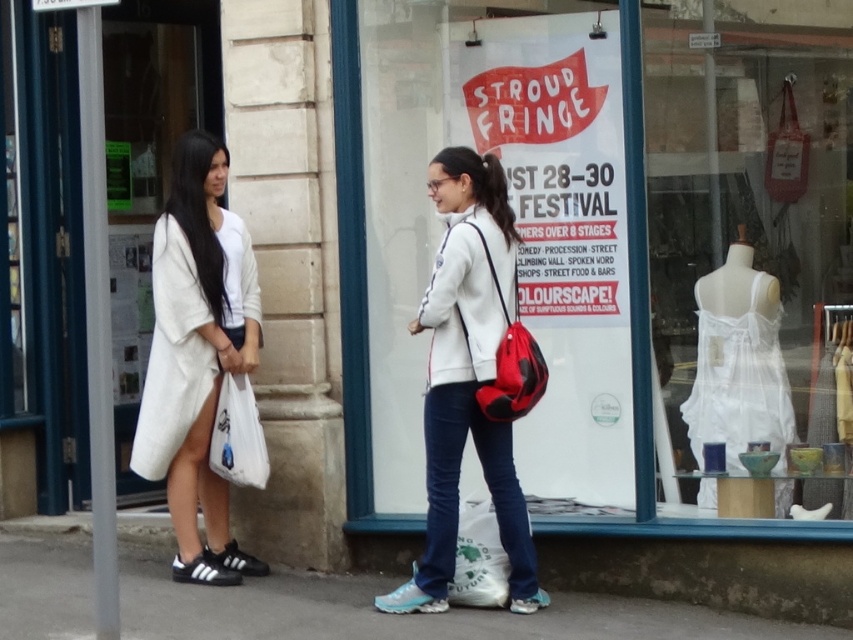
Question: Can you confirm if white sheer fabric dress at right is smaller than white matte jacket at center?

Choices:
 (A) no
 (B) yes

Answer: (A)

Question: Can you confirm if white sheer fabric dress at right is smaller than white cotton coat at left?

Choices:
 (A) no
 (B) yes

Answer: (A)

Question: Which object is positioned farthest from the gray concrete pavement at lower center?

Choices:
 (A) white matte jacket at center
 (B) white cotton coat at left

Answer: (B)

Question: Which of the following is the closest to the observer?

Choices:
 (A) gray concrete pavement at lower center
 (B) white matte jacket at center

Answer: (A)

Question: Can you confirm if white sheer fabric dress at right is positioned to the right of white matte jacket at center?

Choices:
 (A) yes
 (B) no

Answer: (A)

Question: Which of the following is the closest to the observer?

Choices:
 (A) (577, 600)
 (B) (183, 301)
 (C) (744, 134)
 (D) (473, 410)

Answer: (D)